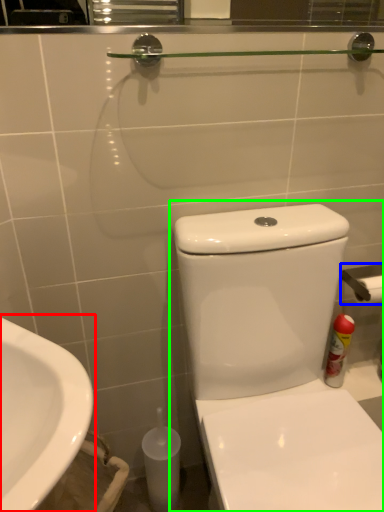
Question: Based on their relative distances, which object is nearer to sink (highlighted by a red box)? Choose from towel bar (highlighted by a blue box) and toilet (highlighted by a green box).

Choices:
 (A) towel bar
 (B) toilet

Answer: (B)